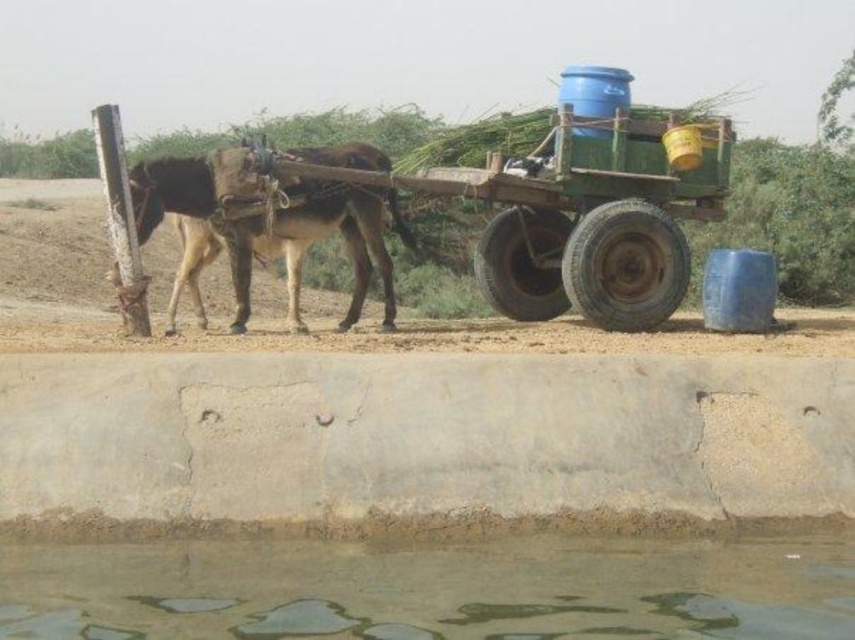
Question: In this image, where is green wooden cart at center located relative to brown rough donkey at left?

Choices:
 (A) right
 (B) left

Answer: (A)

Question: Estimate the real-world distances between objects in this image. Which object is farther from the clear water at lower center?

Choices:
 (A) brown rough donkey at left
 (B) green wooden cart at center

Answer: (B)

Question: Does clear water at lower center have a greater width compared to green wooden cart at center?

Choices:
 (A) yes
 (B) no

Answer: (A)

Question: Which object appears closest to the camera in this image?

Choices:
 (A) clear water at lower center
 (B) brown rough donkey at left
 (C) green wooden cart at center

Answer: (A)

Question: Does green wooden cart at center have a lesser width compared to brown rough donkey at left?

Choices:
 (A) yes
 (B) no

Answer: (B)

Question: Which of the following is the farthest from the observer?

Choices:
 (A) green wooden cart at center
 (B) clear water at lower center
 (C) brown rough donkey at left

Answer: (A)